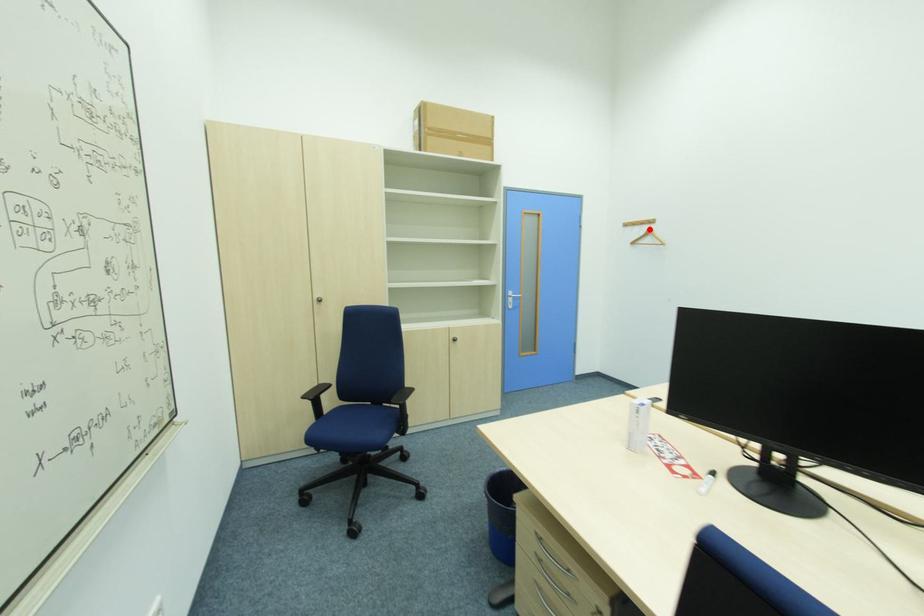
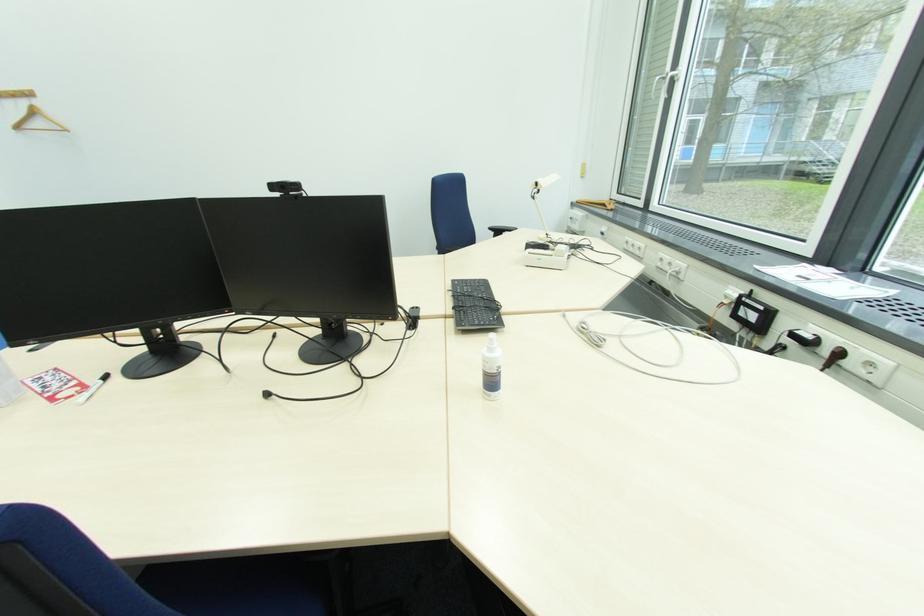
Question: I am providing you with two images of the same scene from different viewpoints. A red point is marked on the first image. Can you still see the location of the red point in image 2?

Choices:
 (A) Yes
 (B) No

Answer: (A)